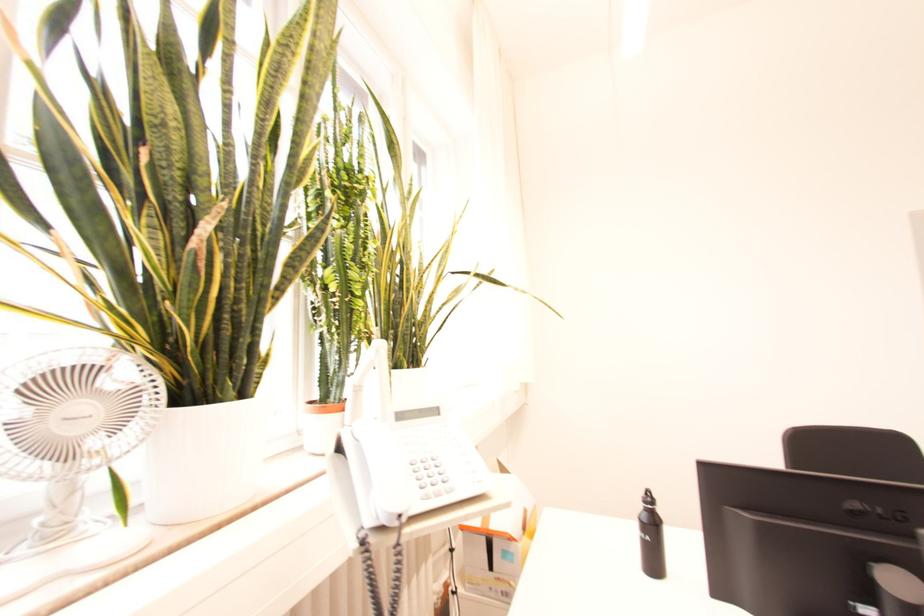
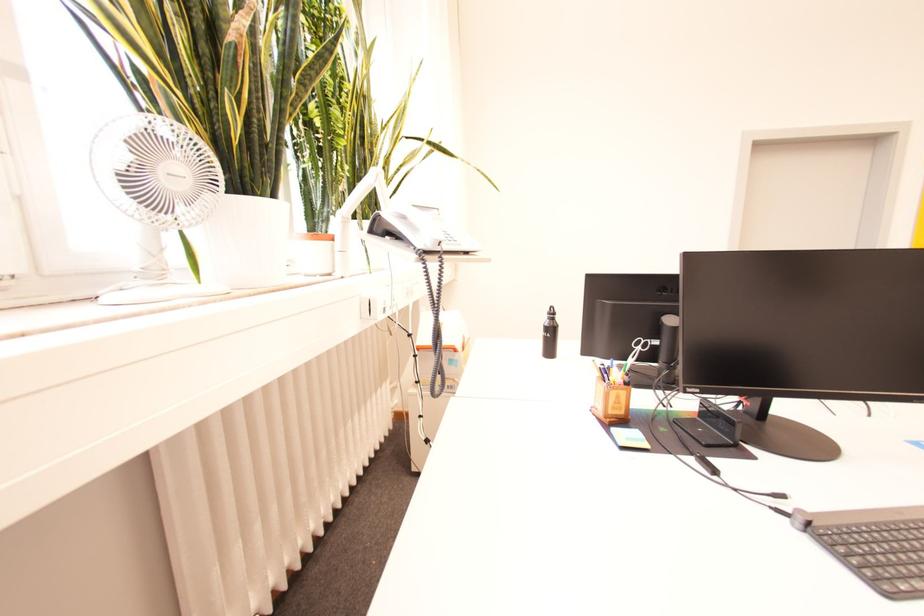
In the second image, find the point that corresponds to pixel 73 419 in the first image.

(176, 176)